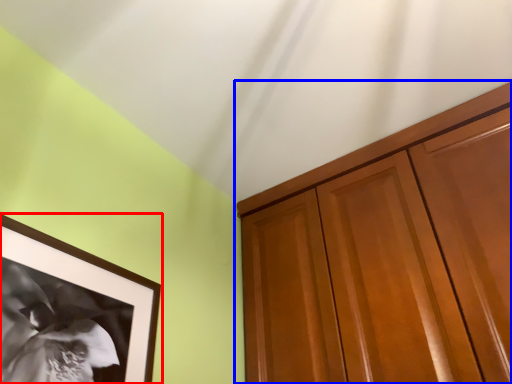
Question: Which point is closer to the camera, picture frame (highlighted by a red box) or cabinetry (highlighted by a blue box)?

Choices:
 (A) picture frame
 (B) cabinetry

Answer: (A)